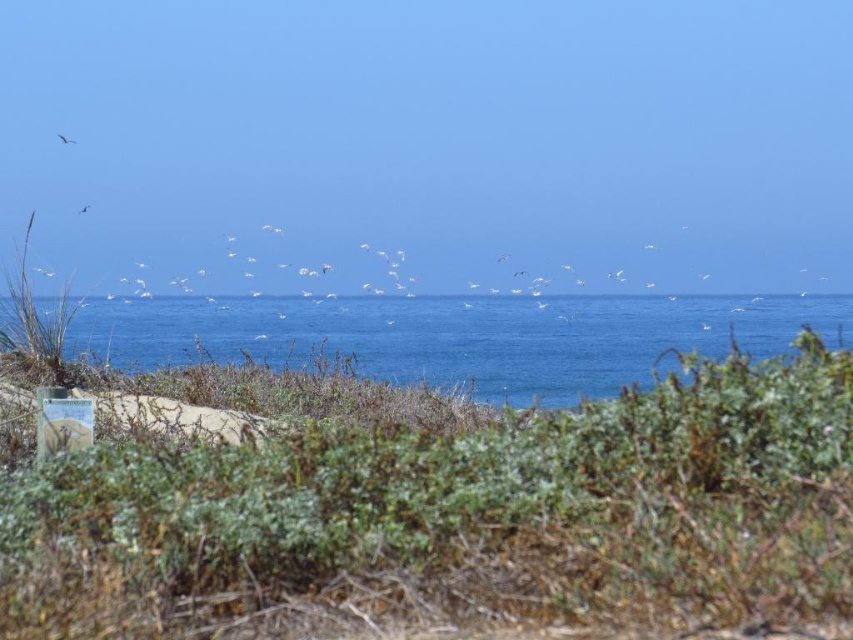
You are standing at the center of the coastal scene and want to observe both the green shrubbery at center and the white feathered bird at upper left. Which object is closer to you?

The green shrubbery at center is closer to you since it is only 21.95 meters away from the white feathered bird at upper left, but since you are at the center, the shrubbery is right where you are standing, making it closer than the bird which is 21.95 meters away.

You are a photographer standing on the beach and want to capture both the blue water at center and the white feathered bird at upper center in a single shot. Based on their positions, will the bird appear above or below the water in the photo?

The white feathered bird at upper center is above the blue water at center, so the bird will appear above the water in the photo.